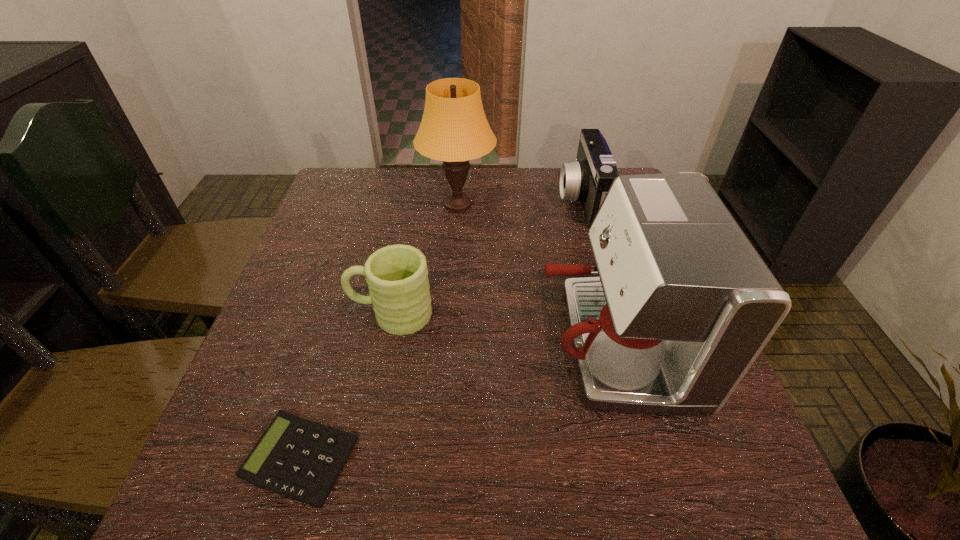
Image resolution: width=960 pixels, height=540 pixels. I want to click on blank region between the coffee maker and the lampshade, so click(x=536, y=274).

I want to click on free space between the lampshade and the shortest object, so click(379, 332).

The width and height of the screenshot is (960, 540). What are the coordinates of `object that stands as the third closest to the camcorder` in the screenshot? It's located at (397, 275).

Where is `object identified as the fourth closest to the lampshade`? Image resolution: width=960 pixels, height=540 pixels. object identified as the fourth closest to the lampshade is located at coordinates (298, 458).

This screenshot has width=960, height=540. I want to click on vacant position in the image that satisfies the following two spatial constraints: 1. on the front side of the lampshade; 2. on the side of the mug with the handle, so click(x=451, y=314).